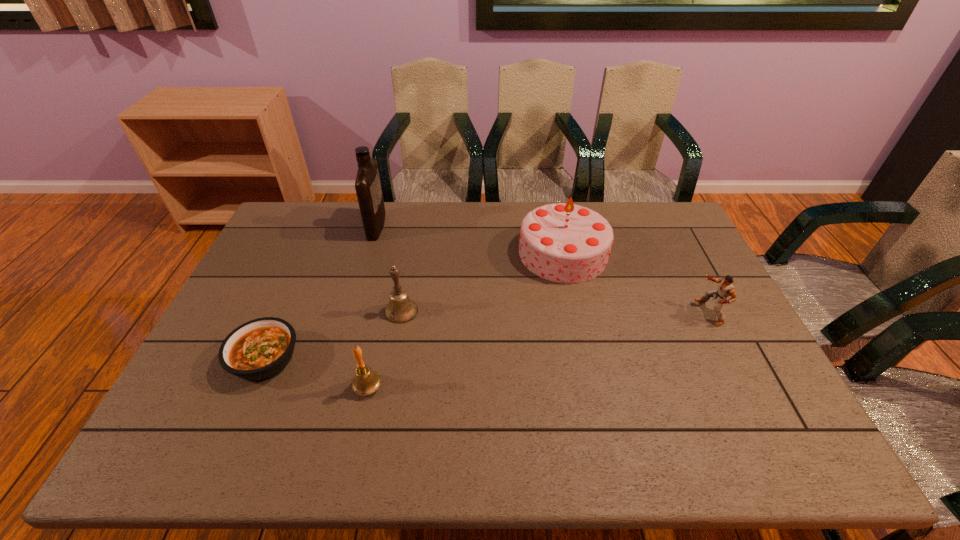
Find the location of a particular element. The image size is (960, 540). vacant region that satisfies the following two spatial constraints: 1. on the label side of the tallest object; 2. on the back side of the nearer bell is located at coordinates (330, 387).